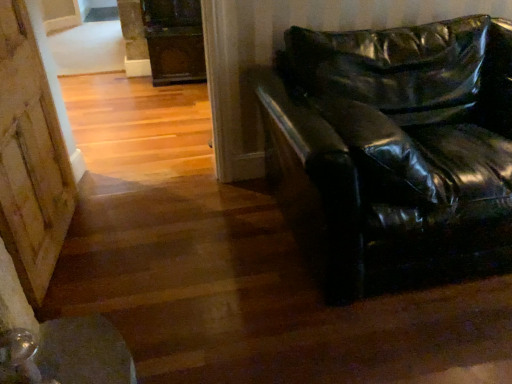
Image resolution: width=512 pixels, height=384 pixels. Describe the element at coordinates (401, 144) in the screenshot. I see `glossy black leather couch at right` at that location.

Measure the distance between point (362, 198) and camera.

The distance of point (362, 198) from camera is 1.49 meters.

This screenshot has height=384, width=512. Identify the location of glossy black leather couch at right. (401, 144).

Locate an element on the screen. wooden barn door at lower left is located at coordinates (30, 157).

Describe the element at coordinates (30, 157) in the screenshot. I see `wooden barn door at lower left` at that location.

Measure the distance between point (18,252) and camera.

Point (18,252) is 1.62 meters from camera.

Where is `glossy black leather couch at right`? The height and width of the screenshot is (384, 512). glossy black leather couch at right is located at coordinates (401, 144).

Is wooden barn door at lower left at the right side of glossy black leather couch at right?

In fact, wooden barn door at lower left is to the left of glossy black leather couch at right.

In the image, is wooden barn door at lower left positioned in front of or behind glossy black leather couch at right?

Visually, wooden barn door at lower left is located behind glossy black leather couch at right.

Does point (10, 93) come farther from viewer compared to point (351, 234)?

Yes, it is.

From the image's perspective, between wooden barn door at lower left and glossy black leather couch at right, who is located below?

wooden barn door at lower left, from the image's perspective.

In the scene shown: From a real-world perspective, between wooden barn door at lower left and glossy black leather couch at right, who is vertically lower?

glossy black leather couch at right, from a real-world perspective.

Can you confirm if wooden barn door at lower left is thinner than glossy black leather couch at right?

Correct, the width of wooden barn door at lower left is less than that of glossy black leather couch at right.

Considering the relative sizes of wooden barn door at lower left and glossy black leather couch at right in the image provided, is wooden barn door at lower left shorter than glossy black leather couch at right?

No, wooden barn door at lower left is not shorter than glossy black leather couch at right.

Is wooden barn door at lower left bigger than glossy black leather couch at right?

No, wooden barn door at lower left is not bigger than glossy black leather couch at right.

Is wooden barn door at lower left spatially inside glossy black leather couch at right, or outside of it?

wooden barn door at lower left lies outside glossy black leather couch at right.

Would you consider wooden barn door at lower left to be distant from glossy black leather couch at right?

Yes, wooden barn door at lower left is far from glossy black leather couch at right.

Is wooden barn door at lower left positioned with its back to glossy black leather couch at right?

No, wooden barn door at lower left's orientation is not away from glossy black leather couch at right.

How many degrees apart are the facing directions of wooden barn door at lower left and glossy black leather couch at right?

wooden barn door at lower left and glossy black leather couch at right are facing 85.5 degrees away from each other.

Measure the distance from wooden barn door at lower left to glossy black leather couch at right.

4.42 feet.

You are a GUI agent. You are given a task and a screenshot of the screen. Output one action in this format:
    pyautogui.click(x=<x>, y=<y>)
    Task: Click on the barn door on the left of glossy black leather couch at right
    The width and height of the screenshot is (512, 384).
    Given the screenshot: What is the action you would take?
    (x=30, y=157)

Can you confirm if glossy black leather couch at right is positioned to the right of wooden barn door at lower left?

Correct, you'll find glossy black leather couch at right to the right of wooden barn door at lower left.

Between glossy black leather couch at right and wooden barn door at lower left, which one is positioned behind?

wooden barn door at lower left is more distant.

Which is farther, (x=416, y=168) or (x=46, y=231)?

The point (x=46, y=231) is behind.

From the image's perspective, who appears lower, glossy black leather couch at right or wooden barn door at lower left?

wooden barn door at lower left.

From a real-world perspective, does glossy black leather couch at right stand above wooden barn door at lower left?

No, from a real-world perspective, glossy black leather couch at right is not over wooden barn door at lower left

Which of these two, glossy black leather couch at right or wooden barn door at lower left, is thinner?

wooden barn door at lower left.

Considering the sizes of objects glossy black leather couch at right and wooden barn door at lower left in the image provided, who is shorter, glossy black leather couch at right or wooden barn door at lower left?

Standing shorter between the two is glossy black leather couch at right.

In terms of size, does glossy black leather couch at right appear bigger or smaller than wooden barn door at lower left?

Clearly, glossy black leather couch at right is larger in size than wooden barn door at lower left.

Is glossy black leather couch at right inside the boundaries of wooden barn door at lower left, or outside?

glossy black leather couch at right lies outside wooden barn door at lower left.

Is glossy black leather couch at right far from wooden barn door at lower left?

glossy black leather couch at right is far away from wooden barn door at lower left.

In the scene shown: Is glossy black leather couch at right facing away from wooden barn door at lower left?

→ glossy black leather couch at right is not turned away from wooden barn door at lower left.

What's the angular difference between glossy black leather couch at right and wooden barn door at lower left's facing directions?

The facing directions of glossy black leather couch at right and wooden barn door at lower left are 85.5 degrees apart.

The height and width of the screenshot is (384, 512). I want to click on barn door on the left of glossy black leather couch at right, so click(30, 157).

Identify the location of barn door that appears on the left of glossy black leather couch at right. (30, 157).

This screenshot has height=384, width=512. I want to click on barn door behind the glossy black leather couch at right, so click(30, 157).